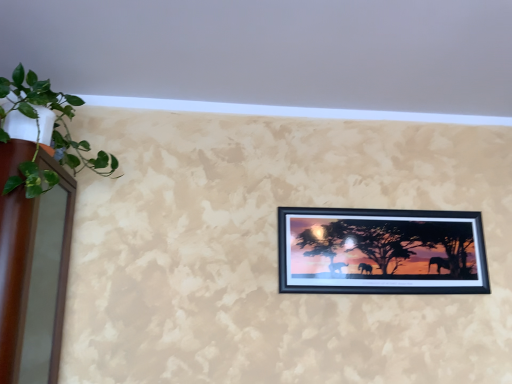
Question: From the image's perspective, is black matte picture frame at center located above or below green leafy plant at left?

Choices:
 (A) below
 (B) above

Answer: (A)

Question: Based on their positions, is black matte picture frame at center located to the left or right of green leafy plant at left?

Choices:
 (A) right
 (B) left

Answer: (A)

Question: Which object is the farthest from the black matte picture frame at center?

Choices:
 (A) beige textured wall at upper center
 (B) green leafy plant at left

Answer: (B)

Question: Considering the real-world distances, which object is farthest from the beige textured wall at upper center?

Choices:
 (A) black matte picture frame at center
 (B) green leafy plant at left

Answer: (B)